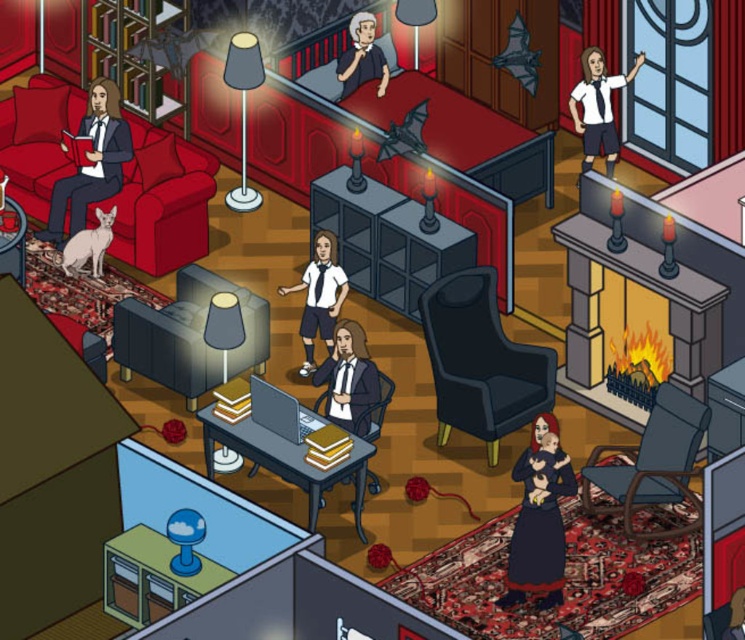
You are a guest in this living room and want to sit down. The matte gray armchair at center and the smooth white shirt at upper center are both visible. Which one can you sit on?

The matte gray armchair at center can be sat on because it is a piece of furniture, while the smooth white shirt at upper center is clothing and not a seating option.

You are standing at the point labeled as point (48, 120) in a living room. You want to take a photo of the entire room. Would the camera positioned at your current location capture the entire living room in one shot?

The camera positioned at point (48, 120) is 17.71 meters away from the camera, so the distance is too far to capture the entire living room in one shot.